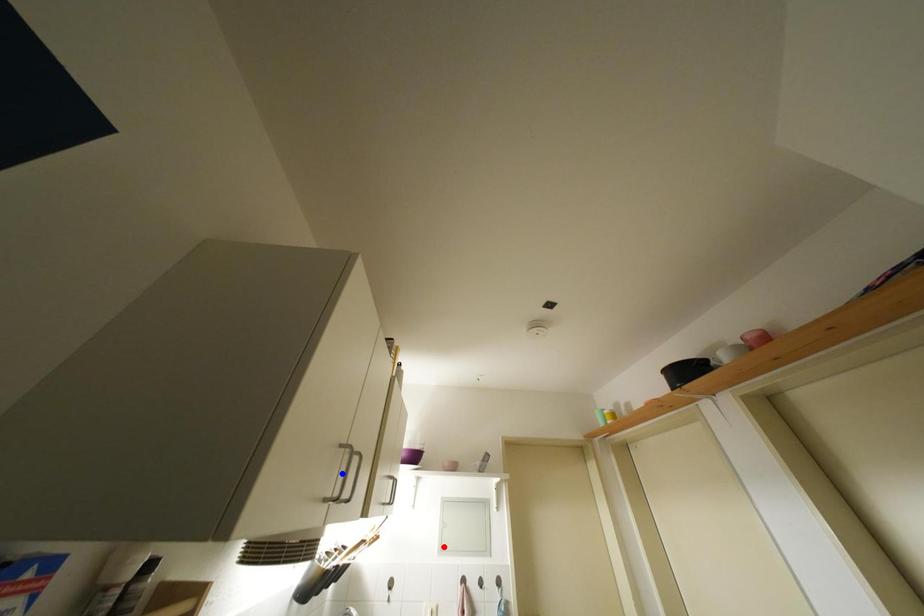
Question: Which of the two points in the image is closer to the camera?

Choices:
 (A) Blue point is closer.
 (B) Red point is closer.

Answer: (A)